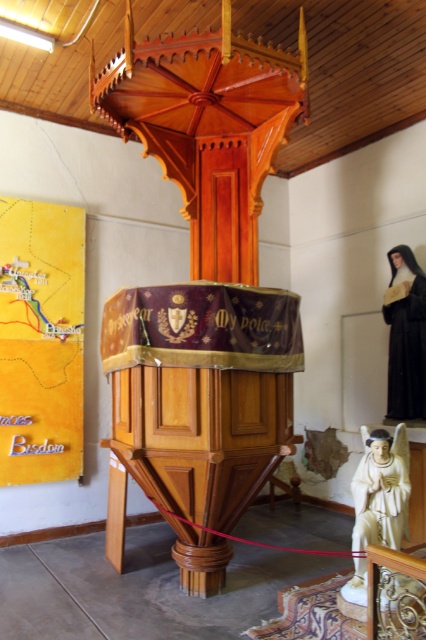
Question: Is white marble statue at lower right bigger than dark brown woolen robe at right?

Choices:
 (A) yes
 (B) no

Answer: (B)

Question: Among these points, which one is farthest from the camera?

Choices:
 (A) pos(408,326)
 (B) pos(362,540)

Answer: (A)

Question: Which point is farther to the camera?

Choices:
 (A) dark brown woolen robe at right
 (B) white marble statue at lower right

Answer: (A)

Question: Is white marble statue at lower right positioned behind dark brown woolen robe at right?

Choices:
 (A) no
 (B) yes

Answer: (A)

Question: Is white marble statue at lower right behind dark brown woolen robe at right?

Choices:
 (A) yes
 (B) no

Answer: (B)